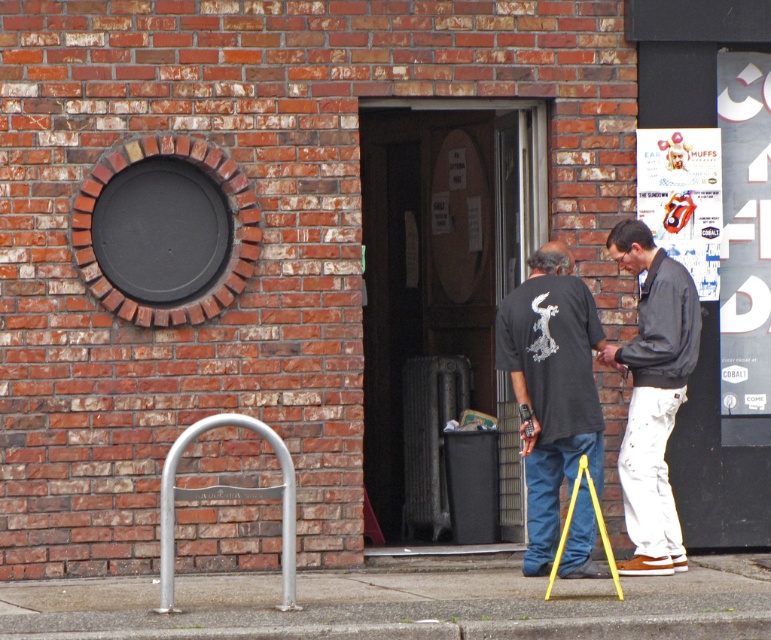
Question: Can you confirm if concrete at lower center is wider than black matte t-shirt at center?

Choices:
 (A) yes
 (B) no

Answer: (A)

Question: Which object is the closest to the concrete at lower center?

Choices:
 (A) yellow plastic tripod at lower center
 (B) black matte t-shirt at center
 (C) silver metallic bike rack at lower left
 (D) light gray cotton jacket at right

Answer: (A)

Question: Is light gray cotton jacket at right above silver metallic bike rack at lower left?

Choices:
 (A) yes
 (B) no

Answer: (A)

Question: Which point appears closest to the camera in this image?

Choices:
 (A) (190, 588)
 (B) (187, 493)
 (C) (517, 310)
 (D) (601, 540)

Answer: (B)

Question: Which object appears farthest from the camera in this image?

Choices:
 (A) yellow plastic tripod at lower center
 (B) silver metallic bike rack at lower left
 (C) concrete at lower center
 (D) black matte t-shirt at center

Answer: (D)

Question: Is black matte t-shirt at center to the right of yellow plastic tripod at lower center from the viewer's perspective?

Choices:
 (A) yes
 (B) no

Answer: (B)